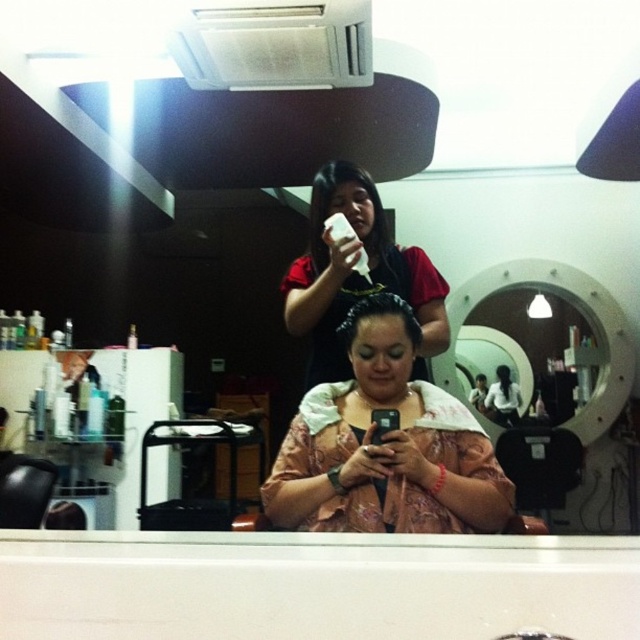
Measure the distance from floral fabric phone at center to matte black phone at center.

A distance of 9.13 feet exists between floral fabric phone at center and matte black phone at center.

Locate an element on the screen. floral fabric phone at center is located at coordinates coord(385,445).

The width and height of the screenshot is (640, 640). Describe the element at coordinates (356, 275) in the screenshot. I see `matte black hairdryer at upper center` at that location.

Find the location of `matte black hairdryer at upper center`. matte black hairdryer at upper center is located at coordinates (356, 275).

Which is behind, point (364, 452) or point (352, 314)?

The point (352, 314) is behind.

Is floral fabric phone at center bigger than brown matte hair at center?

Yes.

The image size is (640, 640). Describe the element at coordinates (385, 445) in the screenshot. I see `floral fabric phone at center` at that location.

Identify the location of floral fabric phone at center. The image size is (640, 640). (385, 445).